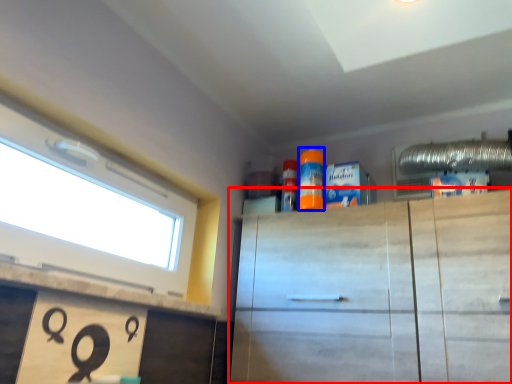
Question: Which point is further to the camera, cabinetry (highlighted by a red box) or cleaning product (highlighted by a blue box)?

Choices:
 (A) cabinetry
 (B) cleaning product

Answer: (B)